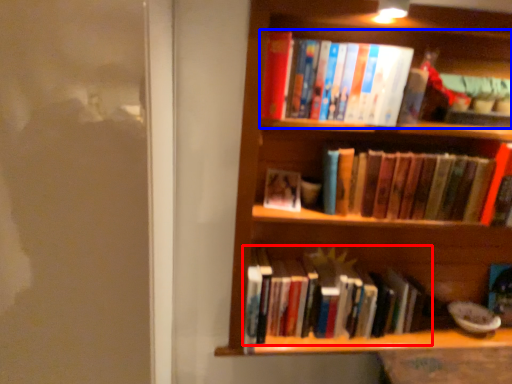
Question: Which object is further to the camera taking this photo, book (highlighted by a red box) or book (highlighted by a blue box)?

Choices:
 (A) book
 (B) book

Answer: (A)